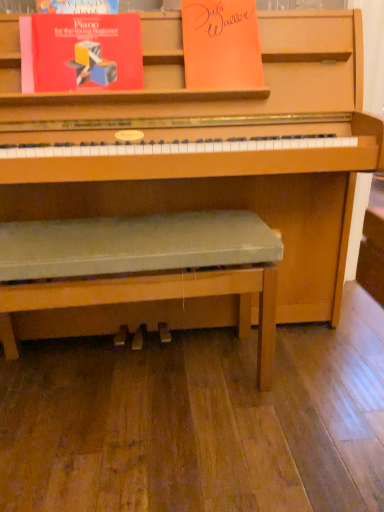
The height and width of the screenshot is (512, 384). What do you see at coordinates (81, 52) in the screenshot?
I see `matte red book at upper left, which appears as the second paperback book when viewed from the right` at bounding box center [81, 52].

Identify the location of matte red book at upper left, which appears as the second paperback book when viewed from the right. The image size is (384, 512). (81, 52).

The image size is (384, 512). Identify the location of orange paper at upper center, the first paperback book positioned from the right. (221, 45).

Locate an element on the screen. matte red book at upper left, which appears as the second paperback book when viewed from the right is located at coordinates (81, 52).

Which object is closer to the camera taking this photo, green fabric bench at center or orange paper at upper center, arranged as the second paperback book when viewed from the left?

Positioned in front is green fabric bench at center.

How much distance is there between green fabric bench at center and orange paper at upper center, the first paperback book positioned from the right?

green fabric bench at center and orange paper at upper center, the first paperback book positioned from the right, are 20.89 inches apart.

Does point (224, 243) appear closer or farther from the camera than point (218, 28)?

Clearly, point (224, 243) is closer to the camera than point (218, 28).

Is orange paper at upper center, the first paperback book positioned from the right, positioned with its back to green fabric bench at center?

No, green fabric bench at center is not at the back of orange paper at upper center, the first paperback book positioned from the right.

From a real-world perspective, which object stands above the other?

In real-world perspective, orange paper at upper center, the first paperback book positioned from the right, is above.

Considering the relative sizes of orange paper at upper center, arranged as the second paperback book when viewed from the left, and green fabric bench at center in the image provided, is orange paper at upper center, arranged as the second paperback book when viewed from the left, bigger than green fabric bench at center?

No.

Which object is positioned more to the left, orange paper at upper center, arranged as the second paperback book when viewed from the left, or green fabric bench at center?

green fabric bench at center is more to the left.

Does green fabric bench at center turn towards matte red book at upper left, which appears as the second paperback book when viewed from the right?

No, green fabric bench at center is not facing towards matte red book at upper left, which appears as the second paperback book when viewed from the right.

Based on the photo, is green fabric bench at center far away from matte red book at upper left, which ranks as the first paperback book in left-to-right order?

No, green fabric bench at center is not far away from matte red book at upper left, which ranks as the first paperback book in left-to-right order.

Is green fabric bench at center completely or partially outside of matte red book at upper left, which appears as the second paperback book when viewed from the right?

Yes, green fabric bench at center is located beyond the bounds of matte red book at upper left, which appears as the second paperback book when viewed from the right.

Between matte red book at upper left, which ranks as the first paperback book in left-to-right order, and orange paper at upper center, the first paperback book positioned from the right, which one is positioned in front?

Positioned in front is matte red book at upper left, which ranks as the first paperback book in left-to-right order.

Is matte red book at upper left, which ranks as the first paperback book in left-to-right order, facing towards orange paper at upper center, arranged as the second paperback book when viewed from the left?

No, matte red book at upper left, which ranks as the first paperback book in left-to-right order, is not facing towards orange paper at upper center, arranged as the second paperback book when viewed from the left.

Considering the sizes of matte red book at upper left, which appears as the second paperback book when viewed from the right, and orange paper at upper center, the first paperback book positioned from the right, in the image, is matte red book at upper left, which appears as the second paperback book when viewed from the right, taller or shorter than orange paper at upper center, the first paperback book positioned from the right,?

In the image, matte red book at upper left, which appears as the second paperback book when viewed from the right, appears to be shorter than orange paper at upper center, the first paperback book positioned from the right.

Does point (33, 56) come farther from viewer compared to point (232, 238)?

Yes, it is behind point (232, 238).

From the image's perspective, does matte red book at upper left, which appears as the second paperback book when viewed from the right, appear lower than green fabric bench at center?

No, from the image's perspective, matte red book at upper left, which appears as the second paperback book when viewed from the right, is not below green fabric bench at center.

Is matte red book at upper left, which ranks as the first paperback book in left-to-right order, inside the boundaries of green fabric bench at center, or outside?

matte red book at upper left, which ranks as the first paperback book in left-to-right order, is not enclosed by green fabric bench at center.

Can you see matte red book at upper left, which appears as the second paperback book when viewed from the right, touching green fabric bench at center?

No, matte red book at upper left, which appears as the second paperback book when viewed from the right, is not beside green fabric bench at center.

Which point is more distant from viewer, (189, 75) or (115, 35)?

The point (189, 75) is farther.

Which object is thinner, orange paper at upper center, the first paperback book positioned from the right, or matte red book at upper left, which appears as the second paperback book when viewed from the right?

matte red book at upper left, which appears as the second paperback book when viewed from the right, is thinner.

Is orange paper at upper center, the first paperback book positioned from the right, far away from matte red book at upper left, which ranks as the first paperback book in left-to-right order?

No, orange paper at upper center, the first paperback book positioned from the right, is not far away from matte red book at upper left, which ranks as the first paperback book in left-to-right order.

Is orange paper at upper center, the first paperback book positioned from the right, inside the boundaries of matte red book at upper left, which ranks as the first paperback book in left-to-right order, or outside?

orange paper at upper center, the first paperback book positioned from the right, is spatially situated outside matte red book at upper left, which ranks as the first paperback book in left-to-right order.

This screenshot has width=384, height=512. I want to click on paperback book to the right of green fabric bench at center, so click(x=221, y=45).

Locate an element on the screen. paperback book that is the 2nd one when counting upward from the green fabric bench at center (from the image's perspective) is located at coordinates (221, 45).

Estimate the real-world distances between objects in this image. Which object is further from green fabric bench at center, matte red book at upper left, which appears as the second paperback book when viewed from the right, or orange paper at upper center, the first paperback book positioned from the right?

Based on the image, orange paper at upper center, the first paperback book positioned from the right, appears to be further to green fabric bench at center.

In the scene shown: Estimate the real-world distances between objects in this image. Which object is further from matte red book at upper left, which ranks as the first paperback book in left-to-right order, green fabric bench at center or orange paper at upper center, arranged as the second paperback book when viewed from the left?

The object further to matte red book at upper left, which ranks as the first paperback book in left-to-right order, is green fabric bench at center.

Which object lies nearer to the anchor point green fabric bench at center, orange paper at upper center, the first paperback book positioned from the right, or matte red book at upper left, which ranks as the first paperback book in left-to-right order?

matte red book at upper left, which ranks as the first paperback book in left-to-right order, lies closer to green fabric bench at center than the other object.

Based on their spatial positions, is matte red book at upper left, which ranks as the first paperback book in left-to-right order, or green fabric bench at center further from orange paper at upper center, the first paperback book positioned from the right?

Based on the image, green fabric bench at center appears to be further to orange paper at upper center, the first paperback book positioned from the right.

Based on their spatial positions, is orange paper at upper center, the first paperback book positioned from the right, or green fabric bench at center further from matte red book at upper left, which ranks as the first paperback book in left-to-right order?

green fabric bench at center is further to matte red book at upper left, which ranks as the first paperback book in left-to-right order.

Estimate the real-world distances between objects in this image. Which object is further from orange paper at upper center, the first paperback book positioned from the right, green fabric bench at center or matte red book at upper left, which ranks as the first paperback book in left-to-right order?

green fabric bench at center is positioned further to the anchor orange paper at upper center, the first paperback book positioned from the right.

Find the location of a particular element. Image resolution: width=384 pixels, height=512 pixels. paperback book between orange paper at upper center, arranged as the second paperback book when viewed from the left, and green fabric bench at center from top to bottom is located at coordinates (81, 52).